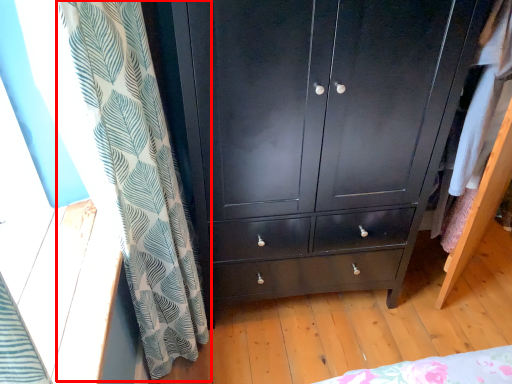
Question: From the image's perspective, considering the relative positions of curtain (annotated by the red box) and chest of drawers in the image provided, where is curtain (annotated by the red box) located with respect to the staircase?

Choices:
 (A) above
 (B) below

Answer: (B)